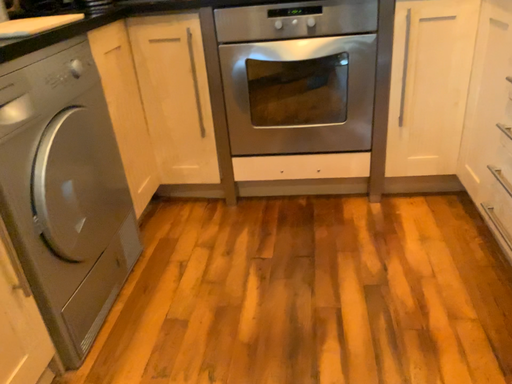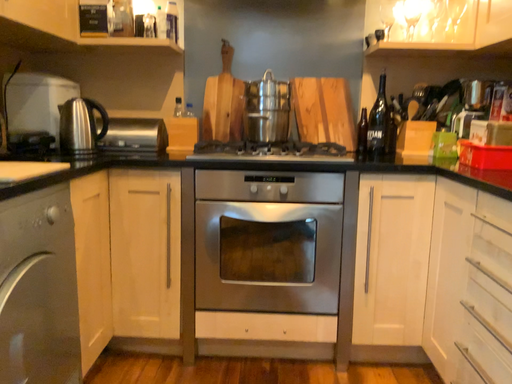
Question: Which way did the camera rotate in the video?

Choices:
 (A) rotated upward
 (B) rotated downward

Answer: (A)